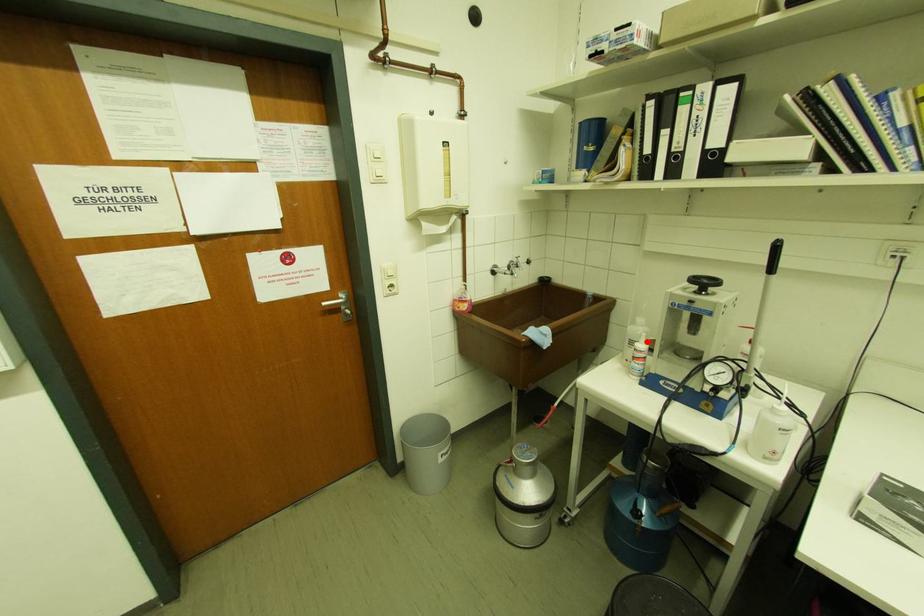
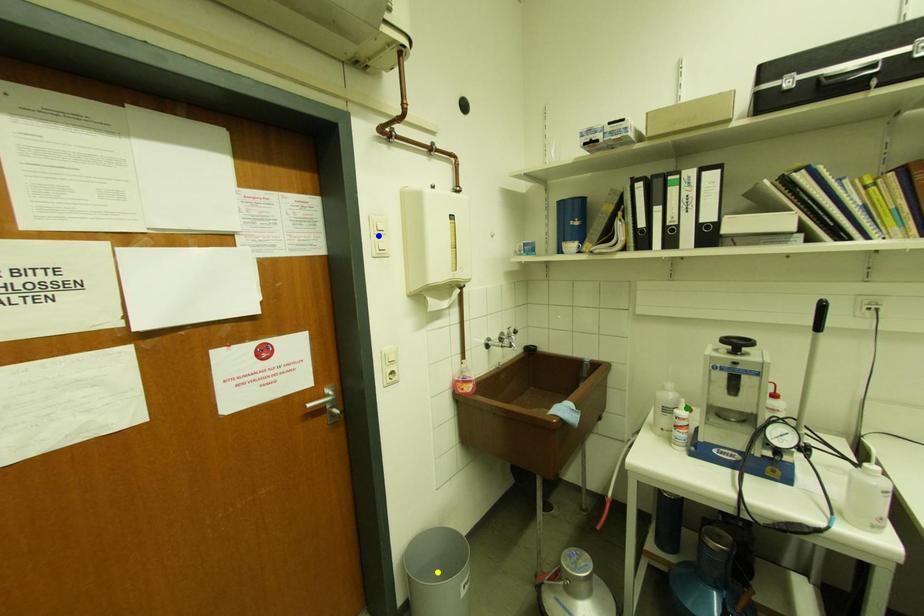
Question: I am providing you with two images of the same scene from different viewpoints. A red point is marked on the first image. You are given multiple points on the second image. Can you choose the point in image 2 that corresponds to the point in image 1?

Choices:
 (A) blue point
 (B) green point
 (C) yellow point

Answer: (B)